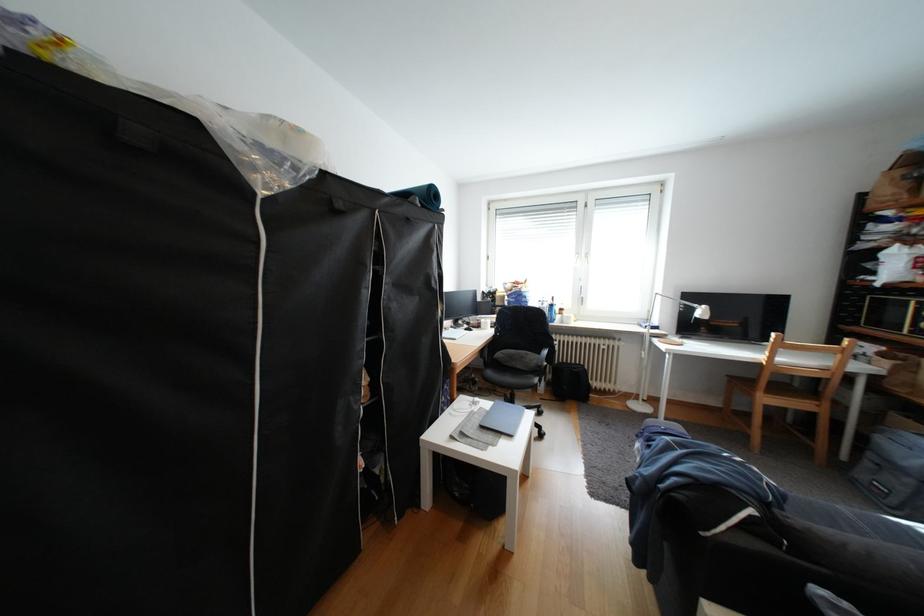
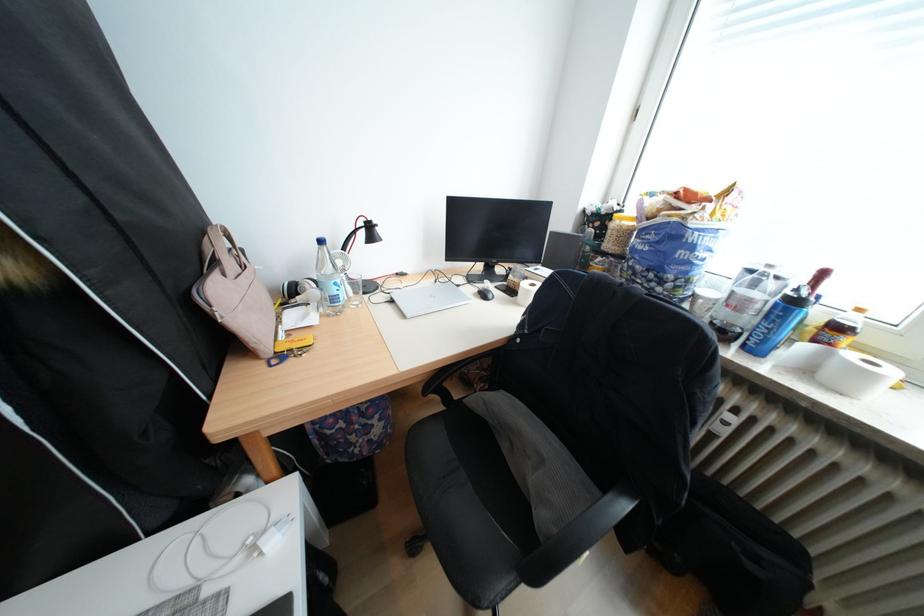
The point at [575,323] is marked in the first image. Where is the corresponding point in the second image?

(821, 371)